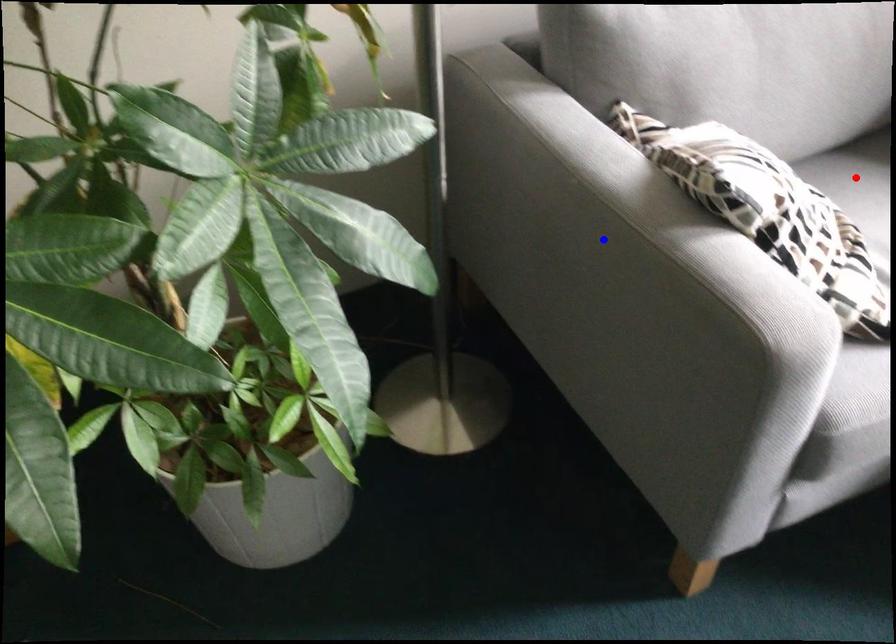
Question: Two points are marked on the image. Which point is closer to the camera?

Choices:
 (A) Blue point is closer.
 (B) Red point is closer.

Answer: (A)